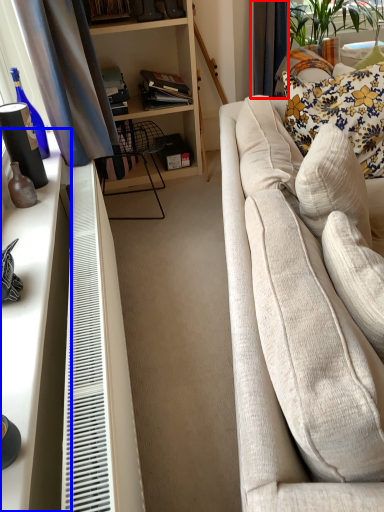
Question: Which of the following is the farthest to the observer, curtain (highlighted by a red box) or desk (highlighted by a blue box)?

Choices:
 (A) curtain
 (B) desk

Answer: (A)